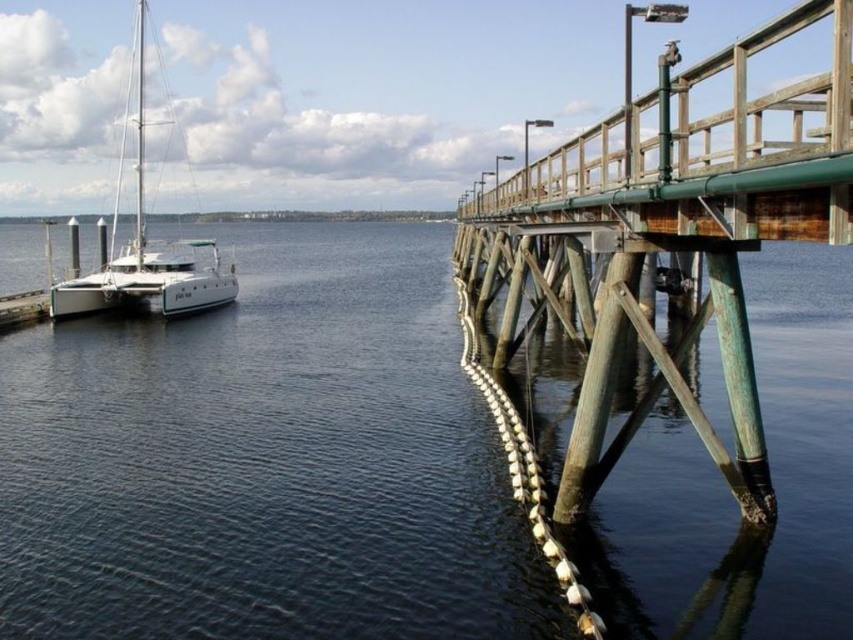
Question: Which point is closer to the camera taking this photo?

Choices:
 (A) (187, 252)
 (B) (294, 564)
 (C) (815, 182)

Answer: (C)

Question: Can you confirm if green wooden pier at upper center is wider than white matte sailboat at left?

Choices:
 (A) yes
 (B) no

Answer: (B)

Question: Which point is closer to the camera?

Choices:
 (A) transparent blue water at center
 (B) green wooden pier at upper center
 (C) white matte sailboat at left

Answer: (B)

Question: Is green wooden pier at upper center above white matte sailboat at left?

Choices:
 (A) no
 (B) yes

Answer: (A)

Question: Can you confirm if transparent blue water at center is positioned below white matte sailboat at left?

Choices:
 (A) no
 (B) yes

Answer: (B)

Question: Which point is farther to the camera?

Choices:
 (A) (129, 300)
 (B) (485, 440)
 (C) (734, 224)

Answer: (A)